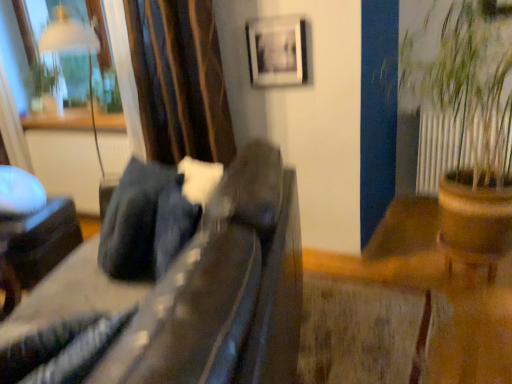
What is the approximate height of suede-like dark brown couch at center, which is the first furniture from front to back?

The height of suede-like dark brown couch at center, which is the first furniture from front to back, is 33.95 inches.

Identify the location of transparent glass window at upper left. The height and width of the screenshot is (384, 512). (67, 70).

Image resolution: width=512 pixels, height=384 pixels. What do you see at coordinates (31, 233) in the screenshot? I see `black glossy side table at lower left, acting as the 2th furniture starting from the right` at bounding box center [31, 233].

Where is `brown wooden pot at right`? This screenshot has height=384, width=512. brown wooden pot at right is located at coordinates (470, 120).

Where is `metallic silver frame at upper center`? This screenshot has height=384, width=512. metallic silver frame at upper center is located at coordinates (277, 51).

Identify the location of furniture located behind the suede-like dark brown couch at center, which ranks as the second furniture in back-to-front order. tap(31, 233).

In the scene shown: Who is more distant, black glossy side table at lower left, the first furniture when ordered from left to right, or suede-like dark brown couch at center, which is the first furniture from front to back?

black glossy side table at lower left, the first furniture when ordered from left to right, is more distant.

Does black glossy side table at lower left, positioned as the 1th furniture in back-to-front order, appear on the right side of suede-like dark brown couch at center, which ranks as the first furniture in right-to-left order?

Incorrect, black glossy side table at lower left, positioned as the 1th furniture in back-to-front order, is not on the right side of suede-like dark brown couch at center, which ranks as the first furniture in right-to-left order.

Which is behind, point (248, 20) or point (452, 191)?

The point (248, 20) is behind.

Locate an element on the screen. picture frame on the left of brown wooden pot at right is located at coordinates (277, 51).

In the image, is metallic silver frame at upper center positioned in front of or behind brown wooden pot at right?

metallic silver frame at upper center is positioned farther from the viewer than brown wooden pot at right.

Between metallic silver frame at upper center and brown wooden pot at right, which one has more height?

Standing taller between the two is brown wooden pot at right.

Which of these two, suede-like dark brown couch at center, which is the first furniture from front to back, or velvet-like brown curtain at upper left, stands shorter?

suede-like dark brown couch at center, which is the first furniture from front to back.

Does suede-like dark brown couch at center, which is the first furniture from front to back, lie behind velvet-like brown curtain at upper left?

No, the depth of suede-like dark brown couch at center, which is the first furniture from front to back, is less than that of velvet-like brown curtain at upper left.

Is suede-like dark brown couch at center, which ranks as the second furniture in back-to-front order, far away from velvet-like brown curtain at upper left?

suede-like dark brown couch at center, which ranks as the second furniture in back-to-front order, is near velvet-like brown curtain at upper left, not far away.

Measure the distance between suede-like dark brown couch at center, the 2th furniture positioned from the left, and velvet-like brown curtain at upper left.

suede-like dark brown couch at center, the 2th furniture positioned from the left, and velvet-like brown curtain at upper left are 36.99 inches apart.

In terms of size, does brown wooden pot at right appear bigger or smaller than transparent glass window at upper left?

Clearly, brown wooden pot at right is larger in size than transparent glass window at upper left.

How distant is brown wooden pot at right from transparent glass window at upper left?

The distance of brown wooden pot at right from transparent glass window at upper left is 6.93 feet.

From the image's perspective, which is below, brown wooden pot at right or transparent glass window at upper left?

brown wooden pot at right.

Which is correct: brown wooden pot at right is inside transparent glass window at upper left, or outside of it?

brown wooden pot at right is spatially situated outside transparent glass window at upper left.

This screenshot has width=512, height=384. I want to click on window on the left of the black glossy side table at lower left, the first furniture when ordered from left to right, so click(x=67, y=70).

What's the angular difference between black glossy side table at lower left, the first furniture when ordered from left to right, and transparent glass window at upper left's facing directions?

There is a 19.8-degree angle between the facing directions of black glossy side table at lower left, the first furniture when ordered from left to right, and transparent glass window at upper left.

Is black glossy side table at lower left, the second furniture from the front, in front of transparent glass window at upper left?

Yes.

Looking at this image, considering their positions, is transparent glass window at upper left located in front of or behind suede-like dark brown couch at center, which ranks as the second furniture in back-to-front order?

In the image, transparent glass window at upper left appears behind suede-like dark brown couch at center, which ranks as the second furniture in back-to-front order.

Is transparent glass window at upper left inside or outside of suede-like dark brown couch at center, which is the first furniture from front to back?

transparent glass window at upper left is spatially situated outside suede-like dark brown couch at center, which is the first furniture from front to back.

Between point (207, 17) and point (290, 74), which one is positioned behind?

Point (290, 74)

Measure the distance between velvet-like brown curtain at upper left and metallic silver frame at upper center.

A distance of 15.88 inches exists between velvet-like brown curtain at upper left and metallic silver frame at upper center.

Could you tell me if velvet-like brown curtain at upper left is turned towards metallic silver frame at upper center?

No, velvet-like brown curtain at upper left does not turn towards metallic silver frame at upper center.

Is velvet-like brown curtain at upper left wider than metallic silver frame at upper center?

Correct, the width of velvet-like brown curtain at upper left exceeds that of metallic silver frame at upper center.

Identify the location of furniture below the black glossy side table at lower left, the first furniture when ordered from left to right (from the image's perspective). (225, 290).

Locate an element on the screen. picture frame above the brown wooden pot at right (from a real-world perspective) is located at coordinates (277, 51).

Which object lies nearer to the anchor point velvet-like brown curtain at upper left, transparent glass window at upper left or brown wooden pot at right?

transparent glass window at upper left is closer to velvet-like brown curtain at upper left.

Based on their spatial positions, is black glossy side table at lower left, the first furniture when ordered from left to right, or brown wooden pot at right further from metallic silver frame at upper center?

The object further to metallic silver frame at upper center is black glossy side table at lower left, the first furniture when ordered from left to right.

When comparing their distances from metallic silver frame at upper center, does brown wooden pot at right or transparent glass window at upper left seem further?

transparent glass window at upper left lies further to metallic silver frame at upper center than the other object.

Estimate the real-world distances between objects in this image. Which object is closer to velvet-like brown curtain at upper left, suede-like dark brown couch at center, which ranks as the second furniture in back-to-front order, or metallic silver frame at upper center?

Based on the image, metallic silver frame at upper center appears to be nearer to velvet-like brown curtain at upper left.

When comparing their distances from transparent glass window at upper left, does velvet-like brown curtain at upper left or metallic silver frame at upper center seem closer?

velvet-like brown curtain at upper left is closer to transparent glass window at upper left.

Based on the photo, which object lies further to the anchor point black glossy side table at lower left, the first furniture when ordered from left to right, metallic silver frame at upper center or brown wooden pot at right?

Among the two, brown wooden pot at right is located further to black glossy side table at lower left, the first furniture when ordered from left to right.

Based on their spatial positions, is brown wooden pot at right or velvet-like brown curtain at upper left closer to suede-like dark brown couch at center, which ranks as the second furniture in back-to-front order?

Based on the image, velvet-like brown curtain at upper left appears to be nearer to suede-like dark brown couch at center, which ranks as the second furniture in back-to-front order.

Based on their spatial positions, is suede-like dark brown couch at center, the 2th furniture positioned from the left, or velvet-like brown curtain at upper left closer to black glossy side table at lower left, the first furniture when ordered from left to right?

Based on the image, velvet-like brown curtain at upper left appears to be nearer to black glossy side table at lower left, the first furniture when ordered from left to right.

Identify the location of furniture between suede-like dark brown couch at center, which is the first furniture from front to back, and transparent glass window at upper left from front to back. (31, 233).

Find the location of a particular element. The height and width of the screenshot is (384, 512). curtain located between transparent glass window at upper left and metallic silver frame at upper center in the left-right direction is located at coordinates (179, 80).

Image resolution: width=512 pixels, height=384 pixels. I want to click on curtain between transparent glass window at upper left and brown wooden pot at right in the horizontal direction, so click(x=179, y=80).

At what (x,y) coordinates should I click in order to perform the action: click on curtain between suede-like dark brown couch at center, which ranks as the first furniture in right-to-left order, and transparent glass window at upper left, along the z-axis. Please return your answer as a coordinate pair (x, y). Looking at the image, I should click on (179, 80).